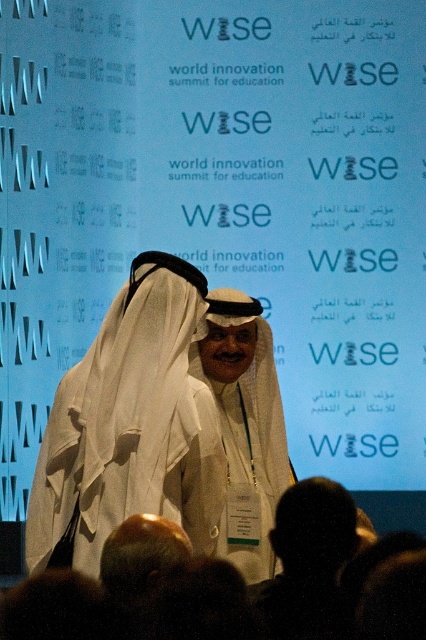
Question: Is white matte robe at center bigger than white matte/soft fabric at center?

Choices:
 (A) yes
 (B) no

Answer: (A)

Question: Which point is closer to the camera taking this photo?

Choices:
 (A) 132,422
 (B) 284,572
 (C) 193,353

Answer: (B)

Question: Which object appears farthest from the camera in this image?

Choices:
 (A) white matte robe at center
 (B) white fabric headscarf at center

Answer: (A)

Question: Which object is positioned farthest from the white matte robe at center?

Choices:
 (A) white matte/soft fabric at center
 (B) white fabric headscarf at center

Answer: (B)

Question: Is white matte/soft fabric at center smaller than white fabric headscarf at center?

Choices:
 (A) no
 (B) yes

Answer: (A)

Question: Can you confirm if white matte/soft fabric at center is positioned to the left of white fabric headscarf at center?

Choices:
 (A) yes
 (B) no

Answer: (A)